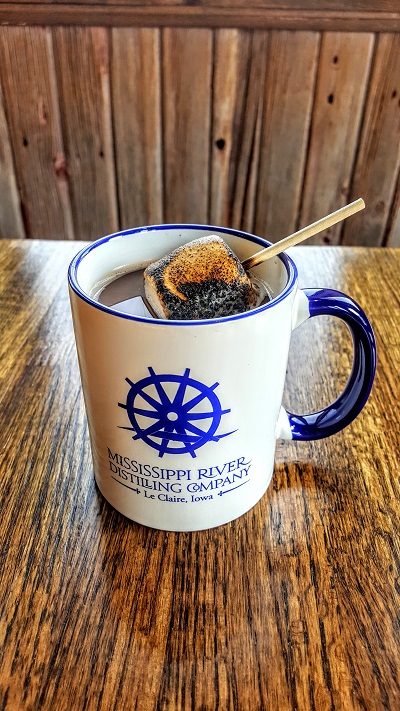
Where is `wood grain`? Image resolution: width=400 pixels, height=711 pixels. wood grain is located at coordinates (x=228, y=643).